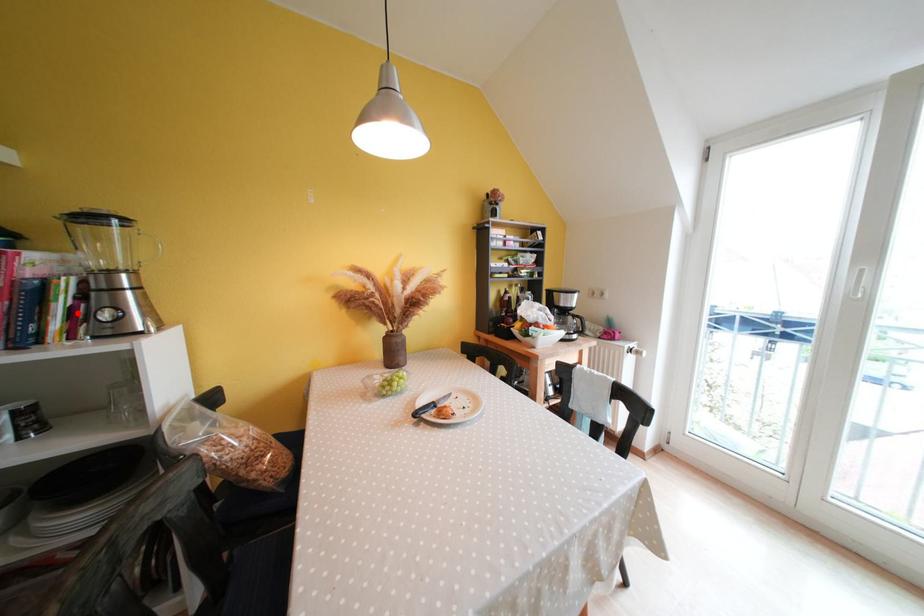
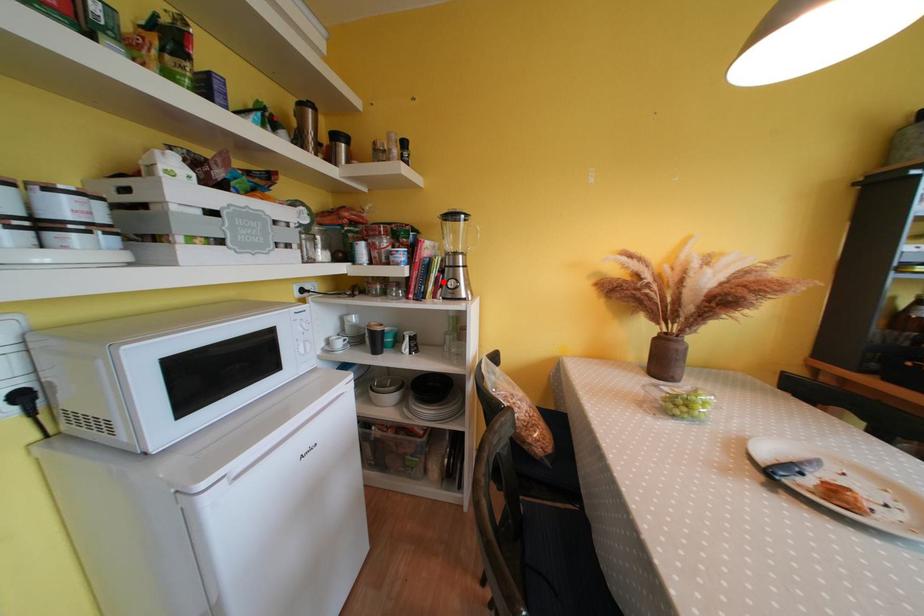
I am providing you with two images of the same scene from different viewpoints. A red point is marked on the first image and another point is marked on the second image. Is the marked point in image1 the same physical position as the marked point in image2?

Yes